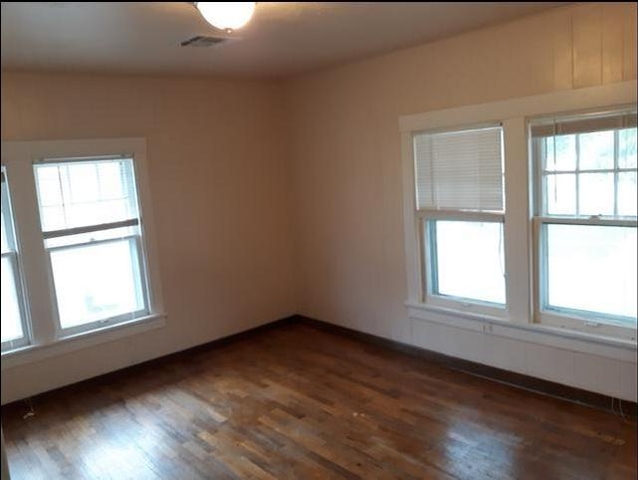
Where is `ceiling vent`? This screenshot has width=638, height=480. ceiling vent is located at coordinates (208, 44).